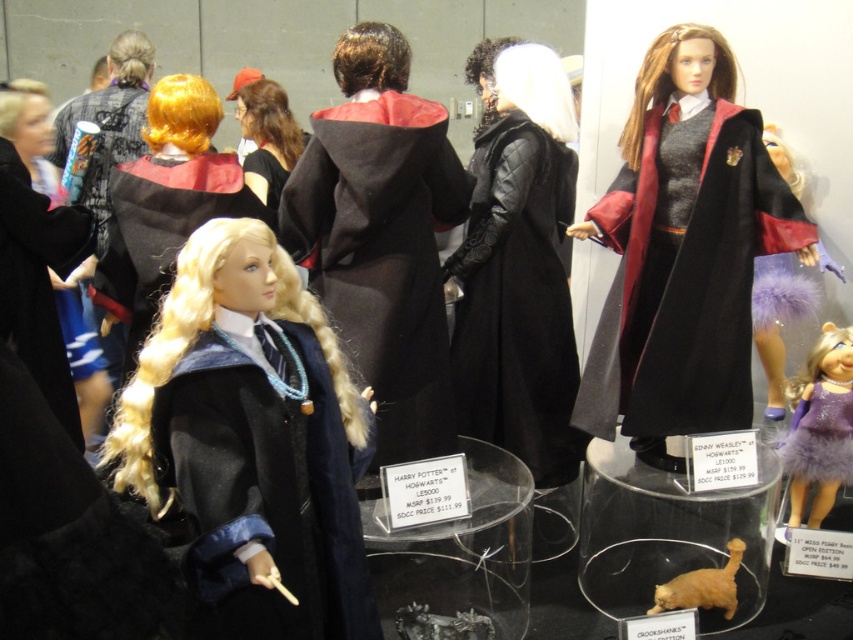
You are a customer at a doll store and see the velvet maroon cape at right and the golden fur cat at lower center. Which object is positioned higher in the image?

The velvet maroon cape at right is above the golden fur cat at lower center, so it is positioned higher in the image.

You are standing in front of the display and want to take a closer look at the velvet maroon cape at right. If your hand can reach up to 6 feet, can you touch it?

The velvet maroon cape at right is 7.48 feet away from the camera, which is beyond the 6 feet reach of your hand. Therefore, you cannot touch it.